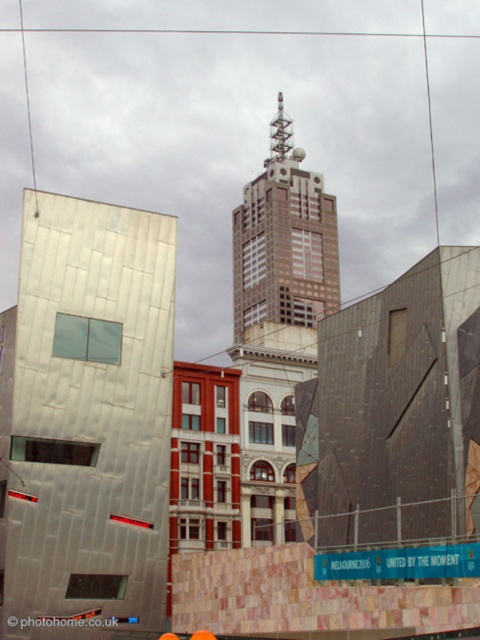
This screenshot has width=480, height=640. Describe the element at coordinates (85, 420) in the screenshot. I see `metallic silver building at left` at that location.

Is point (104, 452) farther from viewer compared to point (290, 182)?

No, (104, 452) is closer to viewer.

This screenshot has height=640, width=480. Describe the element at coordinates (85, 420) in the screenshot. I see `metallic silver building at left` at that location.

This screenshot has width=480, height=640. I want to click on metallic silver building at left, so click(x=85, y=420).